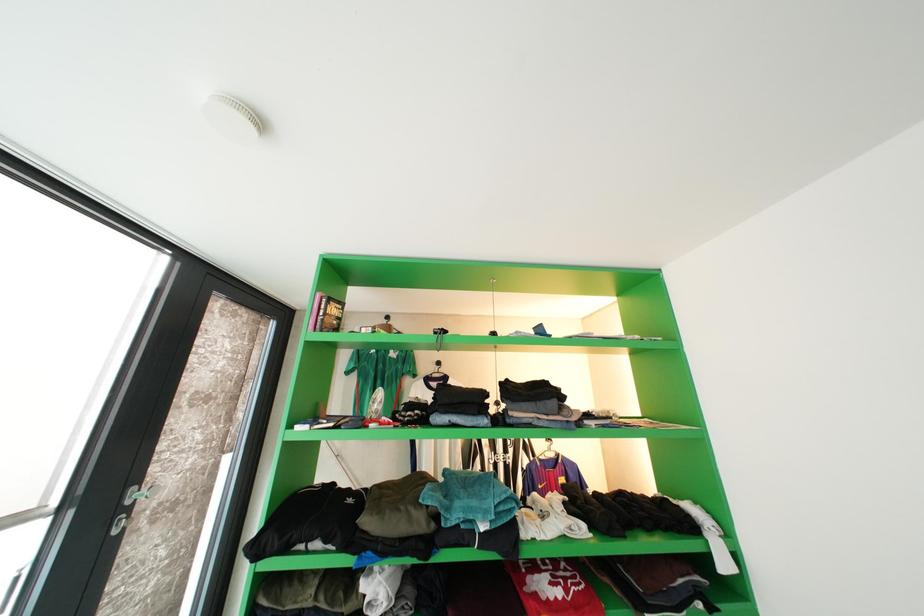
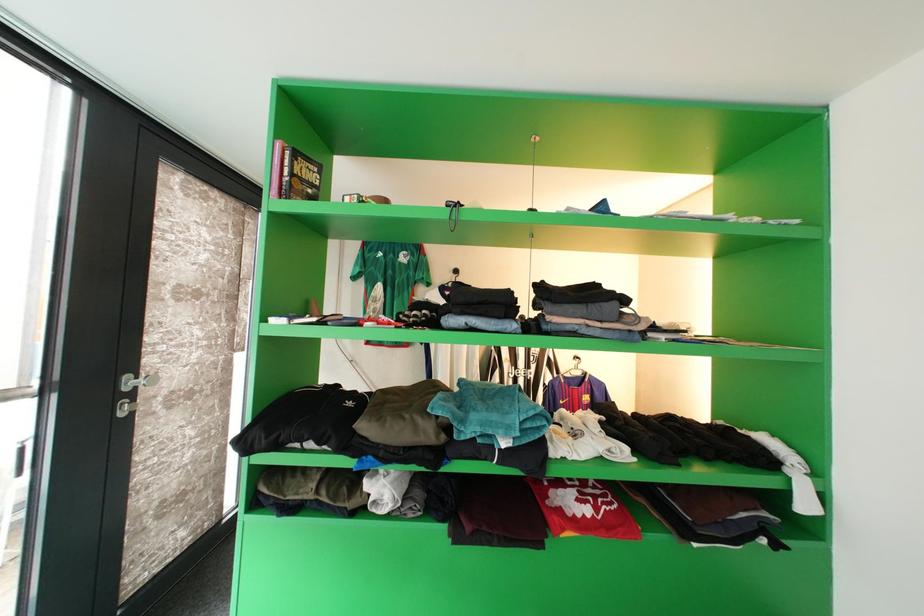
Question: What movement of the cameraman would produce the second image?

Choices:
 (A) Left
 (B) Right
 (C) Forward
 (D) Backward

Answer: (C)